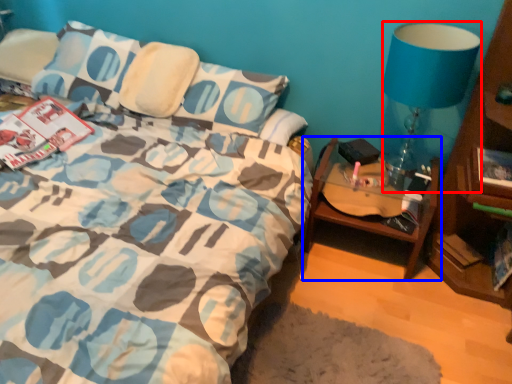
Question: Which point is further to the camera, lamp (highlighted by a red box) or table (highlighted by a blue box)?

Choices:
 (A) lamp
 (B) table

Answer: (B)